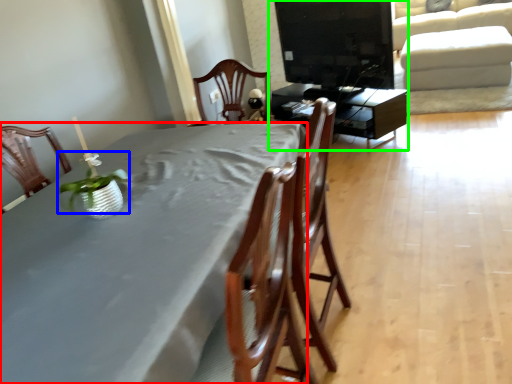
Question: Considering the real-world distances, which object is closest to table (highlighted by a red box)? plant (highlighted by a blue box) or entertainment center (highlighted by a green box).

Choices:
 (A) plant
 (B) entertainment center

Answer: (A)